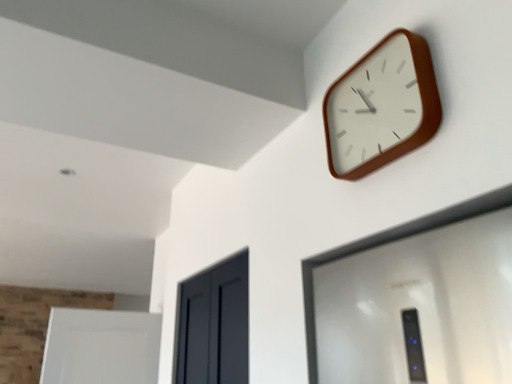
What do you see at coordinates (381, 107) in the screenshot? I see `brown wooden clock at upper right` at bounding box center [381, 107].

Where is `brown wooden clock at upper right`? This screenshot has width=512, height=384. brown wooden clock at upper right is located at coordinates (381, 107).

This screenshot has width=512, height=384. Identify the location of brown wooden clock at upper right. tap(381, 107).